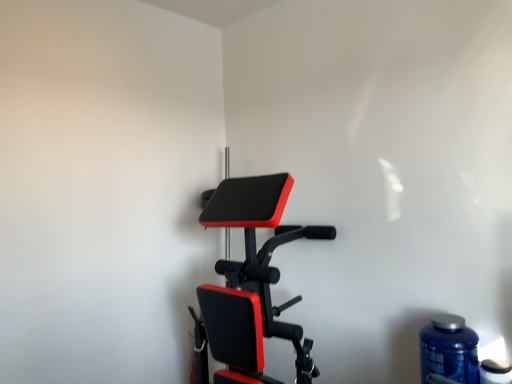
Question: In terms of width, does blue plastic bottle at lower right, which is the 2th bottle from left to right, look wider or thinner when compared to blue plastic bottle at lower right, which is counted as the 2th bottle, starting from the right?

Choices:
 (A) thin
 (B) wide

Answer: (A)

Question: From the image's perspective, is blue plastic bottle at lower right, positioned as the 1th bottle in right-to-left order, located above or below blue plastic bottle at lower right, which is counted as the 2th bottle, starting from the right?

Choices:
 (A) below
 (B) above

Answer: (A)

Question: Estimate the real-world distances between objects in this image. Which object is closer to the matte black stationary bicycle at center?

Choices:
 (A) blue plastic bottle at lower right, which is the 2th bottle from left to right
 (B) blue plastic bottle at lower right, the first bottle from the left

Answer: (B)

Question: Estimate the real-world distances between objects in this image. Which object is closer to the blue plastic bottle at lower right, which is counted as the 2th bottle, starting from the right?

Choices:
 (A) blue plastic bottle at lower right, which is the 2th bottle from left to right
 (B) matte black stationary bicycle at center

Answer: (A)